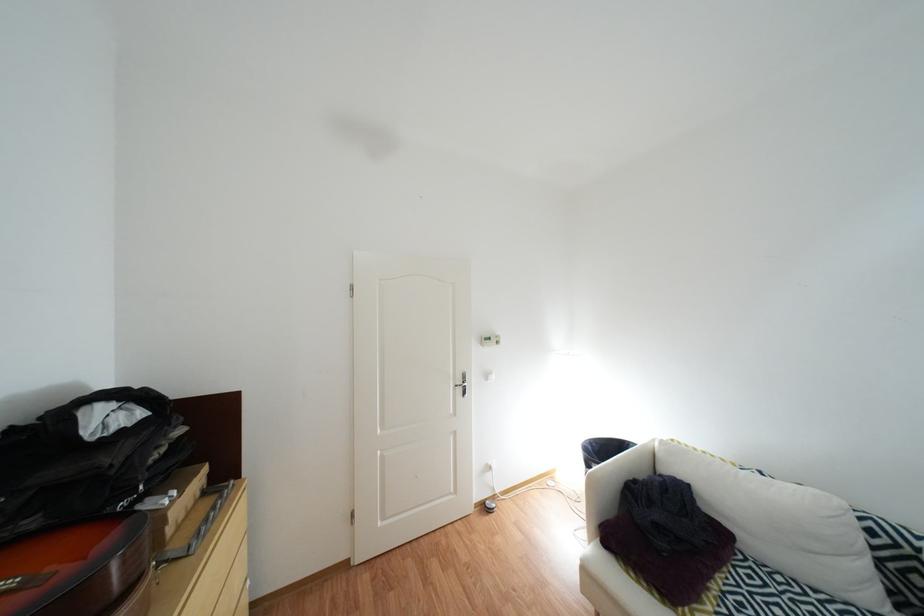
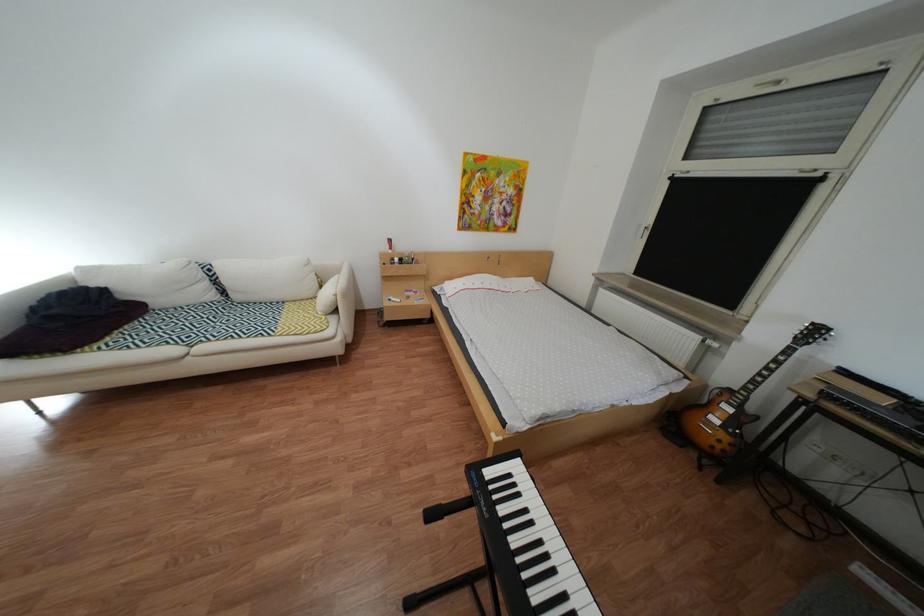
Where in the second image is the point corresponding to point (766, 546) from the first image?

(172, 304)